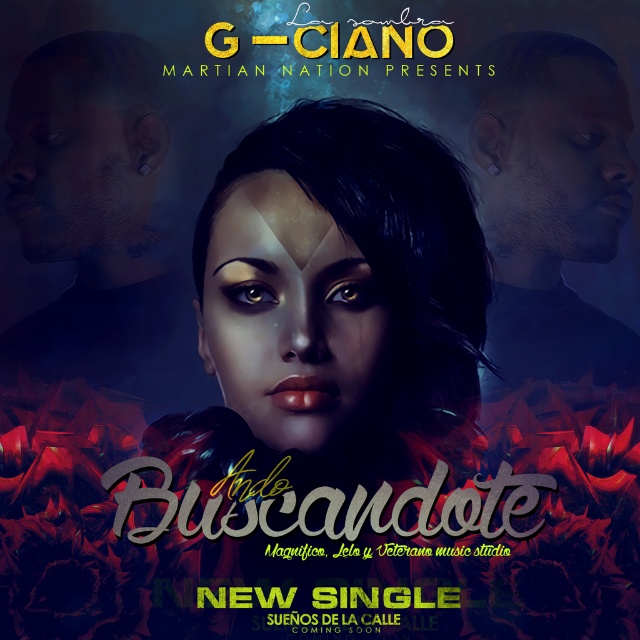
Based on the provided scene description, where is the matte black face at center located in terms of coordinates?

The matte black face at center is located at coordinates point (99,221).

You are a photographer standing 1.5 meters away from the matte black face at center. You want to take a photo of the matte black face at upper right without moving your camera. Can you do it while staying in your current position?

The distance between the matte black face at center and the matte black face at upper right is 1.21 meters. Since you are already 1.5 meters away from the matte black face at center, you can capture the matte black face at upper right in the same frame without moving your camera as the total distance from you to the upper right face would be less than 1.5 meters plus the 1.21 meters, but since they are in the same plane, the camera can likely include both in the frame without moving.